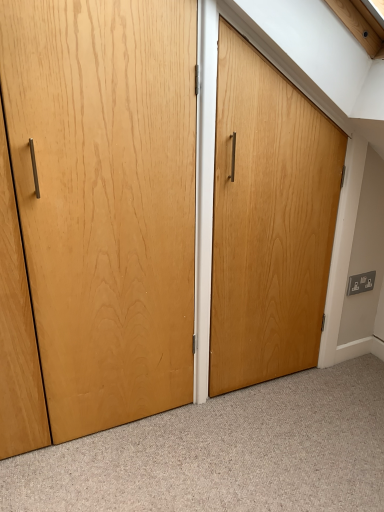
Question: From a real-world perspective, is natural wood door at center above or below satin silver outlet at right?

Choices:
 (A) below
 (B) above

Answer: (B)

Question: Is point click(137, 58) positioned closer to the camera than point click(365, 278)?

Choices:
 (A) farther
 (B) closer

Answer: (B)

Question: Relative to satin silver outlet at right, is natural wood door at center in front or behind?

Choices:
 (A) behind
 (B) front

Answer: (B)

Question: From the image's perspective, is satin silver outlet at right above or below natural wood door at center?

Choices:
 (A) below
 (B) above

Answer: (A)

Question: Is satin silver outlet at right taller or shorter than natural wood door at center?

Choices:
 (A) tall
 (B) short

Answer: (B)

Question: Is satin silver outlet at right bigger or smaller than natural wood door at center?

Choices:
 (A) small
 (B) big

Answer: (A)

Question: Is satin silver outlet at right wider or thinner than natural wood door at center?

Choices:
 (A) thin
 (B) wide

Answer: (B)